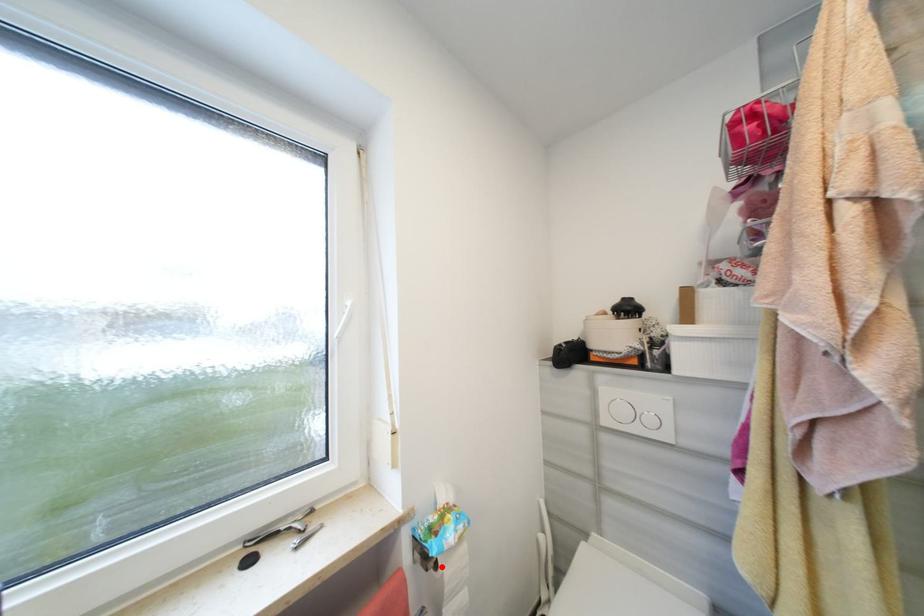
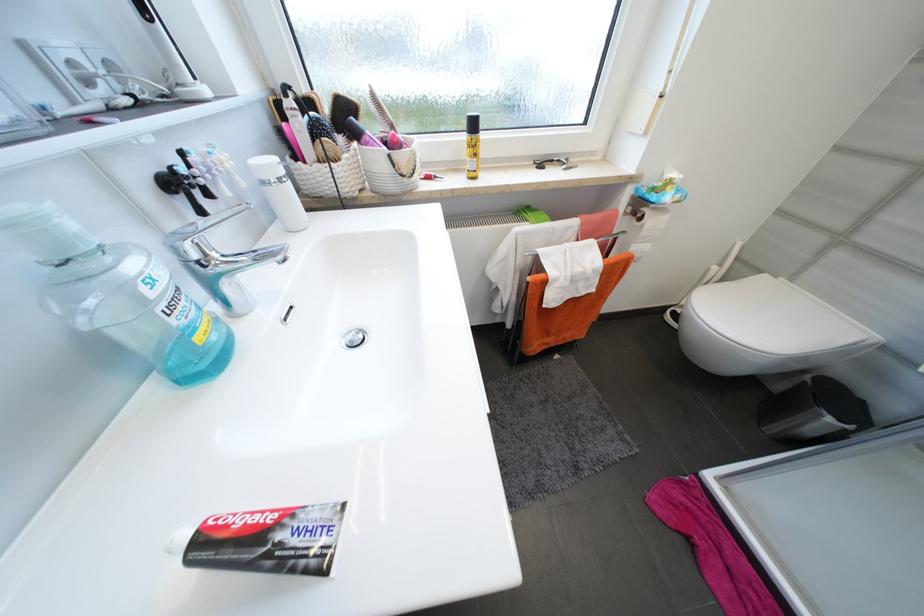
In the second image, find the point that corresponds to the highlighted location in the first image.

(647, 219)